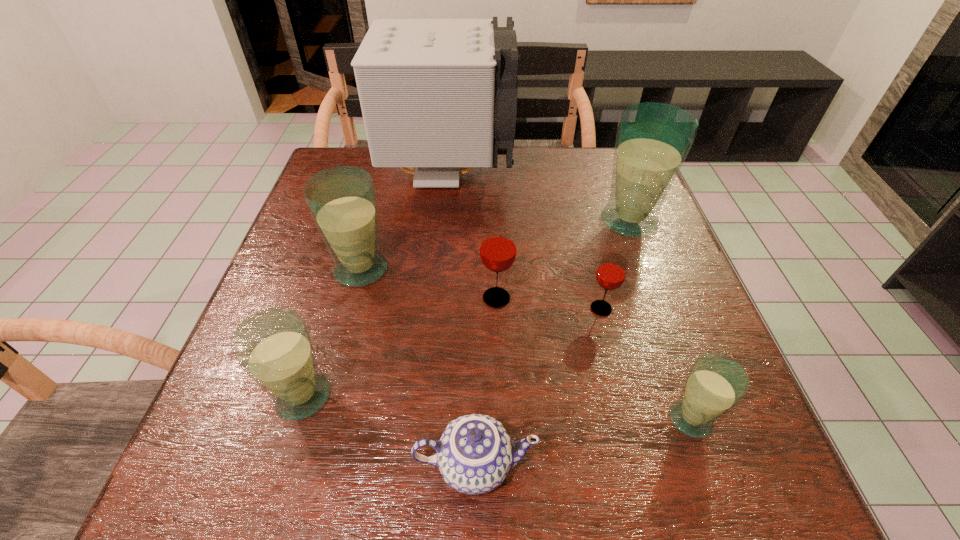
Identify which glass is the second closest to the third smallest blue glass. Please provide its 2D coordinates. Your answer should be formatted as a tuple, i.e. [(x, y)], where the tuple contains the x and y coordinates of a point satisfying the conditions above.

[(498, 248)]

This screenshot has width=960, height=540. I want to click on the fourth closest glass to the tallest object, so click(x=611, y=272).

Find the location of a particular element. This screenshot has width=960, height=540. the third closest blue glass to the fourth glass from right to left is located at coordinates (273, 346).

Locate an element on the screen. blue glass that is the third closest to the fourth glass from right to left is located at coordinates (273, 346).

The image size is (960, 540). What are the coordinates of `vacant space that satisfies the following two spatial constraints: 1. on the front side of the seventh shortest object; 2. on the left side of the gray fan` in the screenshot? It's located at (444, 221).

At what (x,y) coordinates should I click in order to perform the action: click on vacant space that satisfies the following two spatial constraints: 1. on the back side of the gray fan; 2. on the right side of the third biggest blue glass. Please return your answer as a coordinate pair (x, y). The width and height of the screenshot is (960, 540). Looking at the image, I should click on (372, 173).

Find the location of `vacant point that satisfies the following two spatial constraints: 1. on the front side of the biggest blue glass; 2. from the spout of the chinaware`. vacant point that satisfies the following two spatial constraints: 1. on the front side of the biggest blue glass; 2. from the spout of the chinaware is located at coordinates (719, 465).